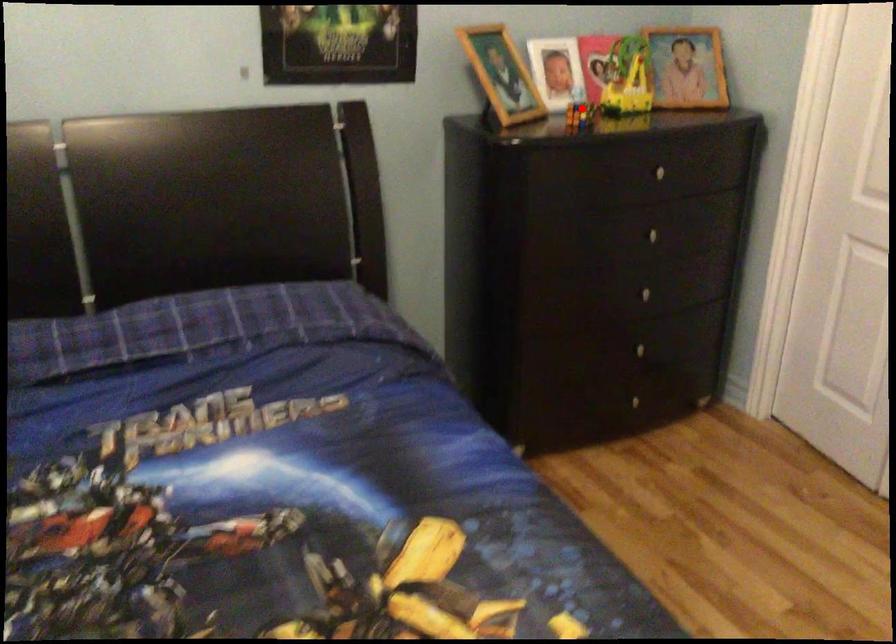
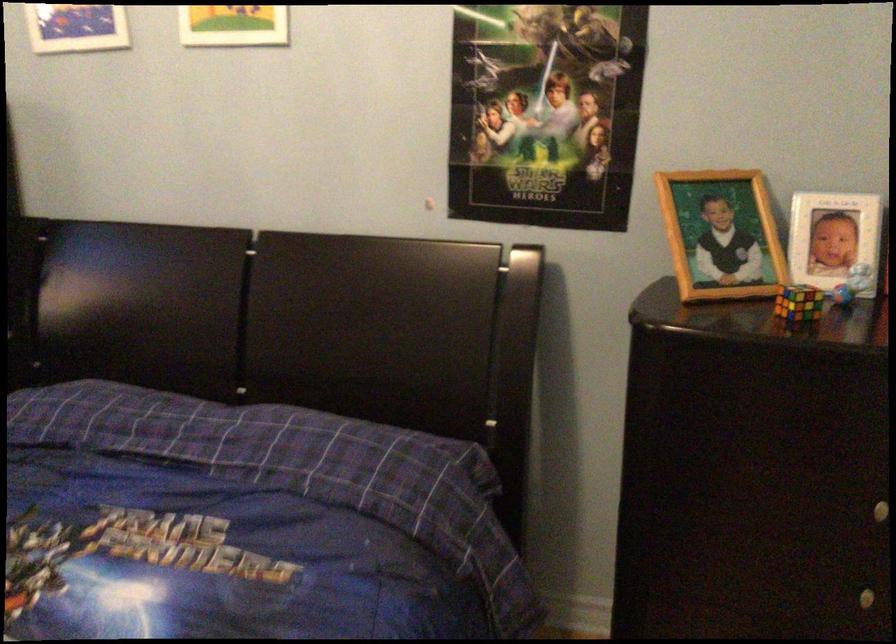
Question: I am providing you with two images of the same scene from different viewpoints. Given a red point in image1, look at the same physical point in image2. Is it:

Choices:
 (A) Closer to the viewpoint
 (B) Farther from the viewpoint

Answer: (A)